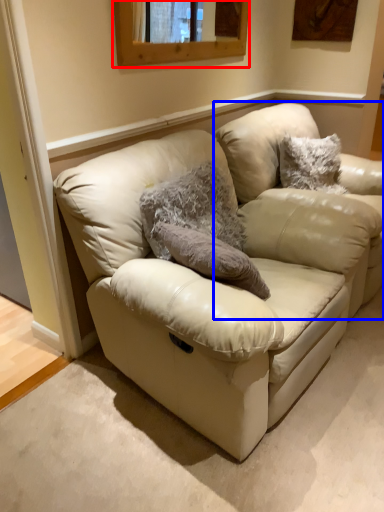
Question: Among these objects, which one is nearest to the camera, window (highlighted by a red box) or swivel chair (highlighted by a blue box)?

Choices:
 (A) window
 (B) swivel chair

Answer: (A)